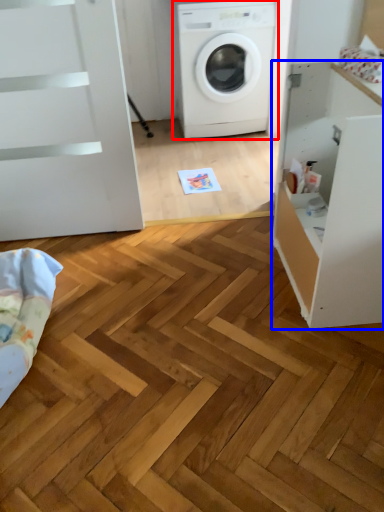
Question: Which object is further to the camera taking this photo, washing machine (highlighted by a red box) or file cabinet (highlighted by a blue box)?

Choices:
 (A) washing machine
 (B) file cabinet

Answer: (A)